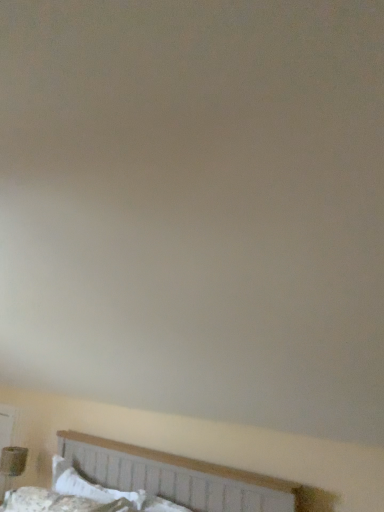
Question: Is white cotton pillow at lower left to the left of matte brown table lamp at lower left from the viewer's perspective?

Choices:
 (A) no
 (B) yes

Answer: (A)

Question: Is matte brown table lamp at lower left at the back of white cotton pillow at lower left?

Choices:
 (A) no
 (B) yes

Answer: (A)

Question: From a real-world perspective, is white cotton pillow at lower left beneath matte brown table lamp at lower left?

Choices:
 (A) yes
 (B) no

Answer: (B)

Question: Considering the relative sizes of white cotton pillow at lower left and matte brown table lamp at lower left in the image provided, is white cotton pillow at lower left shorter than matte brown table lamp at lower left?

Choices:
 (A) no
 (B) yes

Answer: (B)

Question: Does white cotton pillow at lower left come behind matte brown table lamp at lower left?

Choices:
 (A) no
 (B) yes

Answer: (A)

Question: Is white fabric bed at lower center wider or thinner than white cotton pillow at lower left?

Choices:
 (A) thin
 (B) wide

Answer: (B)

Question: From a real-world perspective, is white fabric bed at lower center physically located above or below white cotton pillow at lower left?

Choices:
 (A) below
 (B) above

Answer: (B)

Question: From the image's perspective, is white fabric bed at lower center positioned above or below white cotton pillow at lower left?

Choices:
 (A) above
 (B) below

Answer: (A)

Question: Relative to white cotton pillow at lower left, is white fabric bed at lower center in front or behind?

Choices:
 (A) behind
 (B) front

Answer: (B)

Question: In terms of width, does white cotton pillow at lower left look wider or thinner when compared to white fabric bed at lower center?

Choices:
 (A) wide
 (B) thin

Answer: (B)

Question: Is white cotton pillow at lower left taller or shorter than white fabric bed at lower center?

Choices:
 (A) short
 (B) tall

Answer: (A)

Question: Is white cotton pillow at lower left spatially inside white fabric bed at lower center, or outside of it?

Choices:
 (A) inside
 (B) outside

Answer: (B)

Question: Is white cotton pillow at lower left to the left or to the right of white fabric bed at lower center in the image?

Choices:
 (A) left
 (B) right

Answer: (A)

Question: Looking at the image, does white fabric bed at lower center seem bigger or smaller compared to matte brown table lamp at lower left?

Choices:
 (A) big
 (B) small

Answer: (A)

Question: Considering the positions of white fabric bed at lower center and matte brown table lamp at lower left in the image, is white fabric bed at lower center taller or shorter than matte brown table lamp at lower left?

Choices:
 (A) short
 (B) tall

Answer: (A)